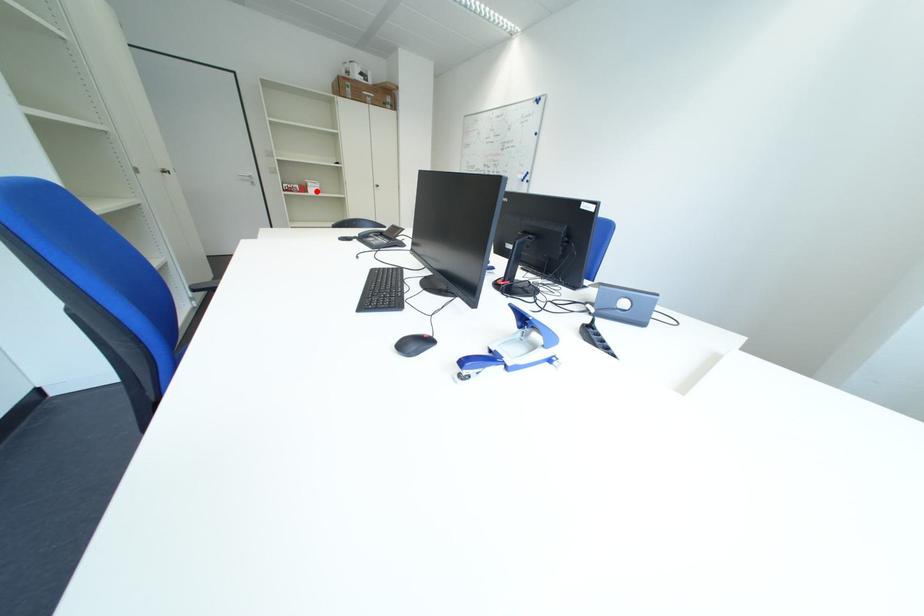
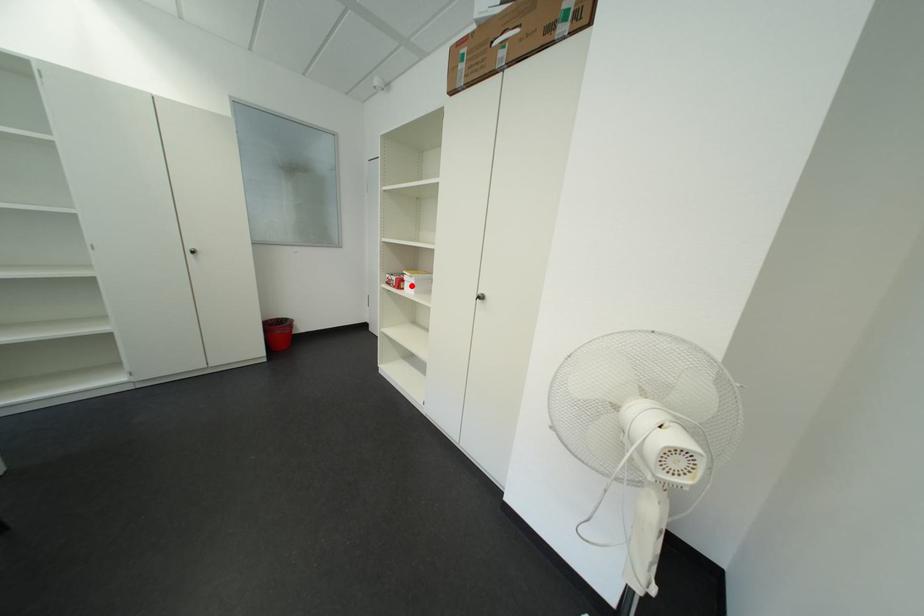
I am providing you with two images of the same scene from different viewpoints. A red point is marked on the first image and another point is marked on the second image. Is the marked point in image1 the same physical position as the marked point in image2?

Yes